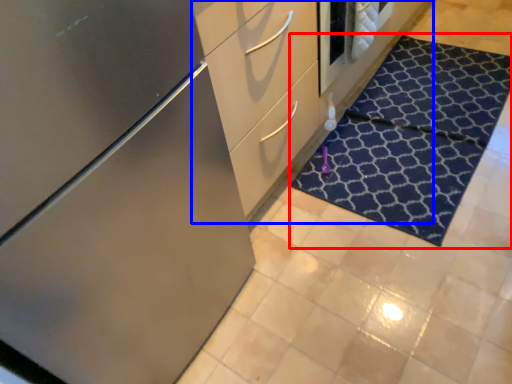
Question: Which object appears farthest to the camera in this image, doormat (highlighted by a red box) or dresser (highlighted by a blue box)?

Choices:
 (A) doormat
 (B) dresser

Answer: (A)